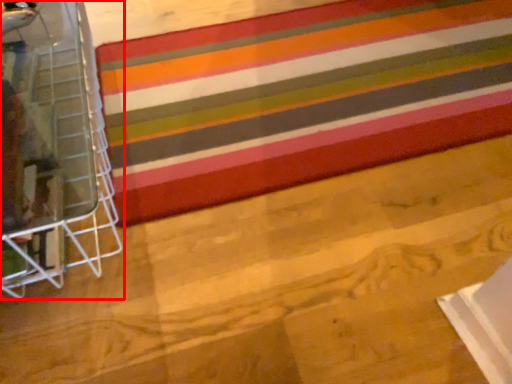
Question: From the image's perspective, what is the correct spatial positioning of furniture (annotated by the red box) in reference to quilt?

Choices:
 (A) below
 (B) above

Answer: (A)